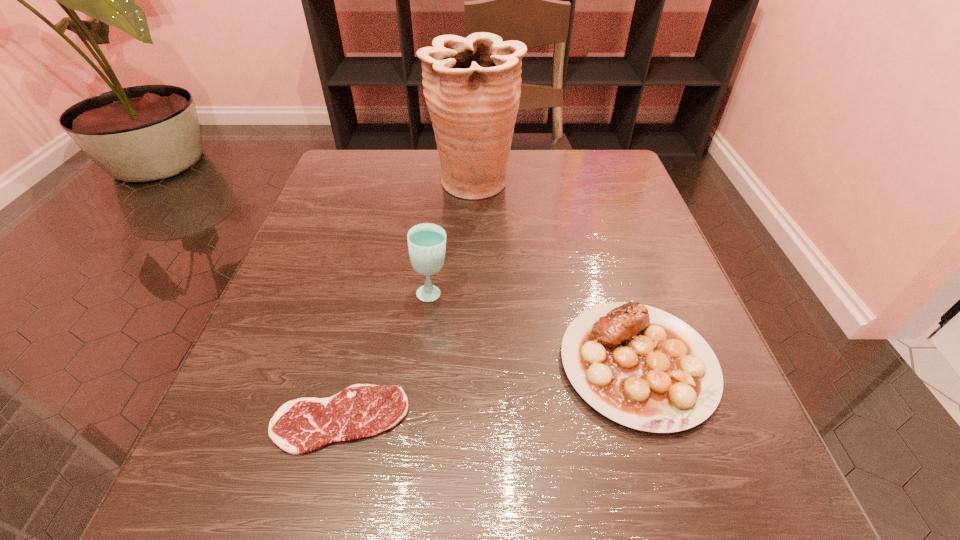
What are the coordinates of `free location located on the back of the taller steak` in the screenshot? It's located at (608, 267).

Where is `vacant space located 0.280m on the back of the left steak`? This screenshot has width=960, height=540. vacant space located 0.280m on the back of the left steak is located at coordinates (380, 258).

The image size is (960, 540). Identify the location of object present at the far edge. (472, 86).

I want to click on object located at the near edge, so click(299, 426).

In order to click on object at the left edge in this screenshot , I will do `click(299, 426)`.

You are a GUI agent. You are given a task and a screenshot of the screen. Output one action in this format:
    pyautogui.click(x=<x>, y=<y>)
    Task: Click on the object that is at the right edge
    This screenshot has height=540, width=960.
    Given the screenshot: What is the action you would take?
    pyautogui.click(x=642, y=367)

Identify the location of object at the near left corner. (299, 426).

Where is `vacant space at the far edge of the desktop`? vacant space at the far edge of the desktop is located at coordinates (537, 160).

Find the location of `vacant space at the near edge of the desktop`. vacant space at the near edge of the desktop is located at coordinates (636, 494).

This screenshot has width=960, height=540. In order to click on free space at the left edge of the desktop in this screenshot , I will do `click(211, 442)`.